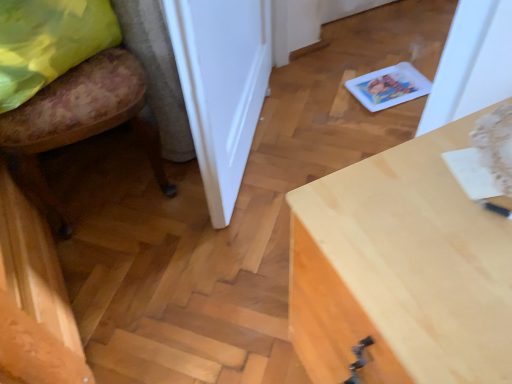
Question: Looking at the image, does white glossy door at center seem bigger or smaller compared to yellow fabric pillow at left?

Choices:
 (A) big
 (B) small

Answer: (A)

Question: Is white glossy door at center spatially inside yellow fabric pillow at left, or outside of it?

Choices:
 (A) outside
 (B) inside

Answer: (A)

Question: Estimate the real-world distances between objects in this image. Which object is farther from the light wood desk at center?

Choices:
 (A) yellow fabric pillow at left
 (B) white glossy door at center
 (C) floral fabric chair at lower left

Answer: (A)

Question: Which of these objects is positioned farthest from the light wood desk at center?

Choices:
 (A) floral fabric chair at lower left
 (B) yellow fabric pillow at left
 (C) white glossy door at center

Answer: (B)